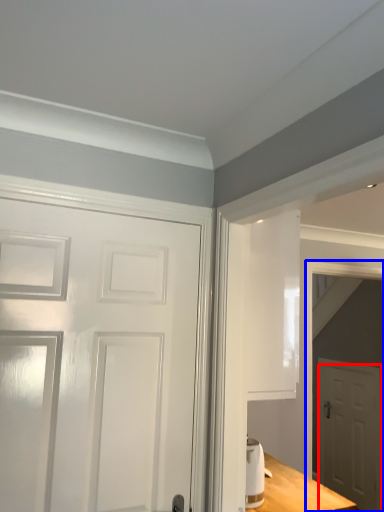
Question: Which object is closer to the camera taking this photo, door (highlighted by a red box) or elevator (highlighted by a blue box)?

Choices:
 (A) door
 (B) elevator

Answer: (B)